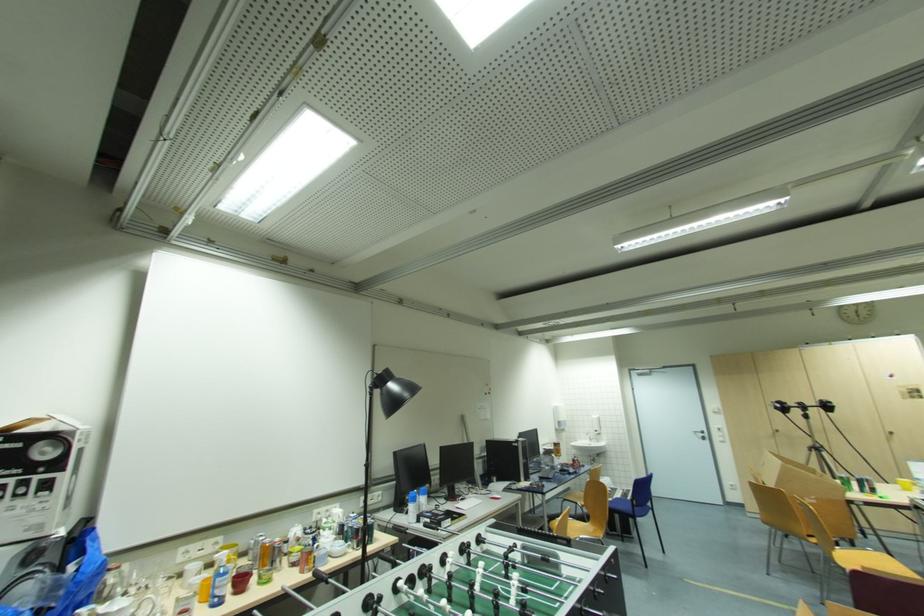
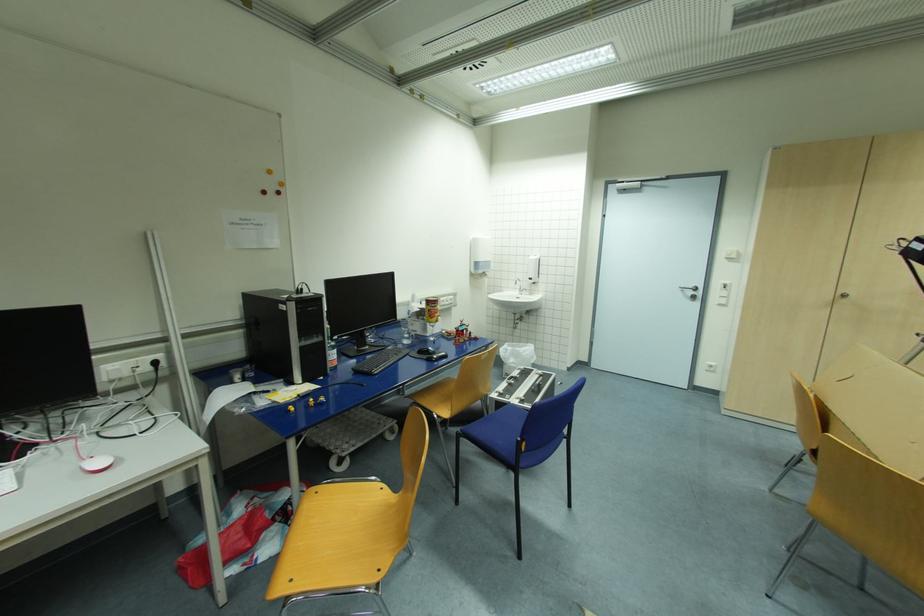
Where in the second image is the point corresponding to pixel 707 432 from the first image?

(699, 289)